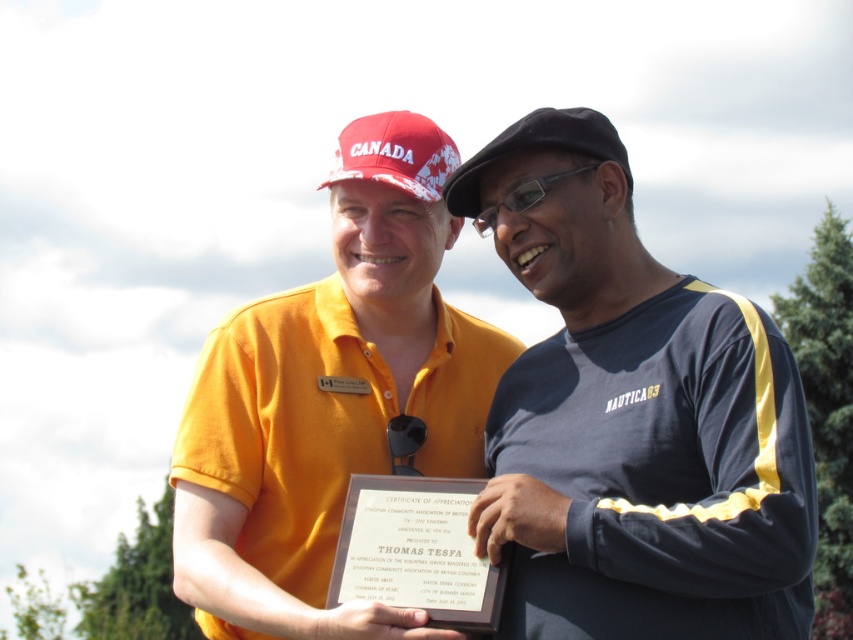
Can you confirm if navy blue jersey at center is taller than black fabric baseball cap at upper center?

Correct, navy blue jersey at center is much taller as black fabric baseball cap at upper center.

Which is in front, point (750, 592) or point (532, 145)?

Point (750, 592) is more forward.

Does point (610, 291) come in front of point (498, 141)?

No, (610, 291) is behind (498, 141).

At what (x,y) coordinates should I click in order to perform the action: click on navy blue jersey at center. Please return your answer as a coordinate pair (x, y). This screenshot has width=853, height=640. Looking at the image, I should click on (631, 417).

Between matte yellow shirt at center and white paper plaque at center, which one is positioned lower?

Positioned lower is white paper plaque at center.

Locate an element on the screen. matte yellow shirt at center is located at coordinates (329, 400).

Is white paper plaque at center thinner than red fabric baseball cap at upper center?

Yes, white paper plaque at center is thinner than red fabric baseball cap at upper center.

Measure the distance between point (451, 600) and camera.

Point (451, 600) is 33.61 meters from camera.

Does point (352, 566) come behind point (358, 177)?

No.

Where is `white paper plaque at center`? This screenshot has height=640, width=853. white paper plaque at center is located at coordinates (416, 552).